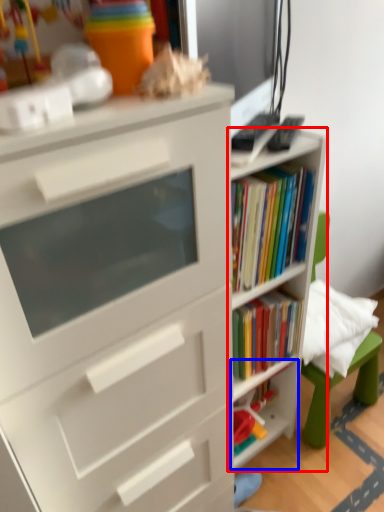
Question: Which object appears farthest to the camera in this image, shelf (highlighted by a red box) or shelf (highlighted by a blue box)?

Choices:
 (A) shelf
 (B) shelf

Answer: (B)